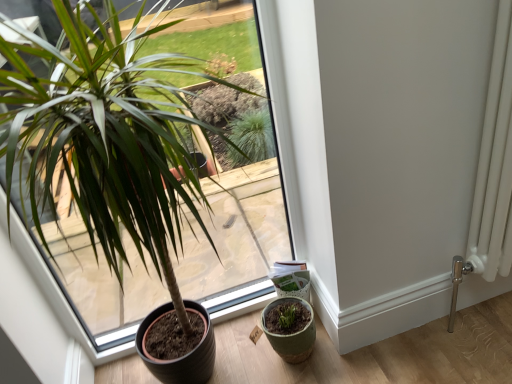
Question: Is green matte plant pot at lower left wider or thinner than green matte flowerpot at lower right?

Choices:
 (A) thin
 (B) wide

Answer: (B)

Question: Considering the positions of green matte plant pot at lower left and green matte flowerpot at lower right in the image, is green matte plant pot at lower left bigger or smaller than green matte flowerpot at lower right?

Choices:
 (A) small
 (B) big

Answer: (B)

Question: From the image's perspective, is green matte plant pot at lower left located above or below green matte flowerpot at lower right?

Choices:
 (A) below
 (B) above

Answer: (B)

Question: From their relative heights in the image, would you say green matte flowerpot at lower right is taller or shorter than green matte plant pot at lower left?

Choices:
 (A) tall
 (B) short

Answer: (B)

Question: Is green matte flowerpot at lower right to the left or to the right of green matte plant pot at lower left in the image?

Choices:
 (A) right
 (B) left

Answer: (A)

Question: Choose the correct answer: Is green matte flowerpot at lower right inside green matte plant pot at lower left or outside it?

Choices:
 (A) outside
 (B) inside

Answer: (A)

Question: Considering the positions of green matte flowerpot at lower right and green matte plant pot at lower left in the image, is green matte flowerpot at lower right wider or thinner than green matte plant pot at lower left?

Choices:
 (A) thin
 (B) wide

Answer: (A)